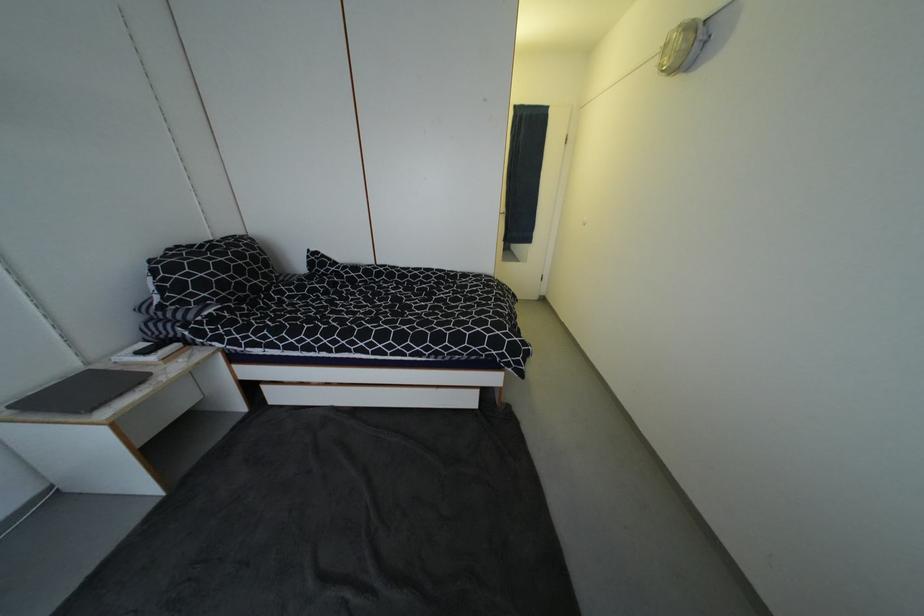
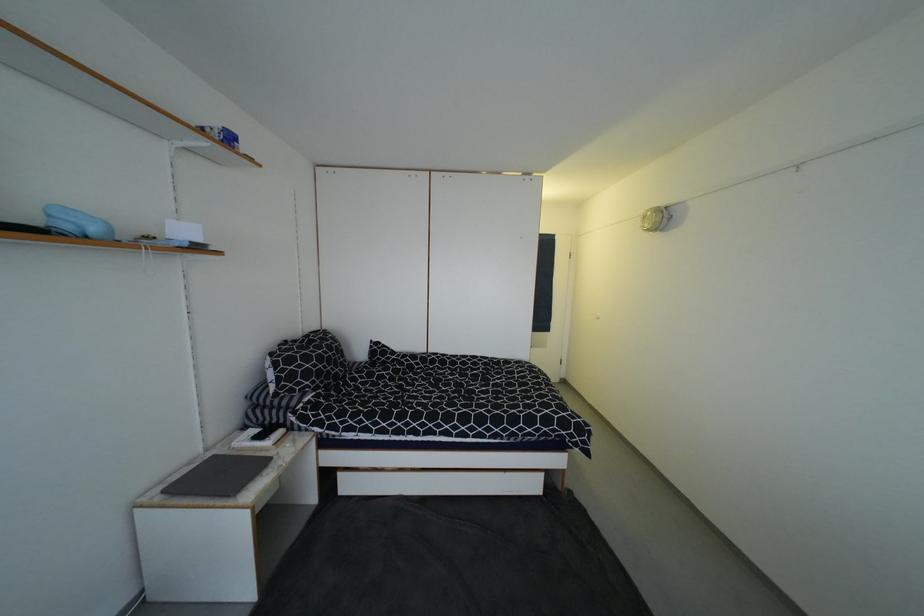
In the second image, find the point that corresponds to (x=195, y=277) in the first image.

(305, 368)